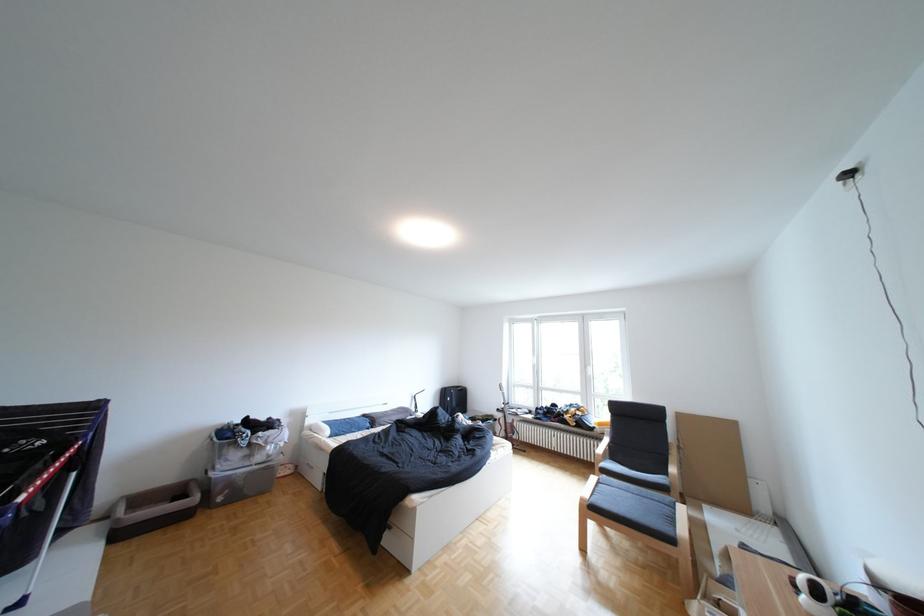
The height and width of the screenshot is (616, 924). Describe the element at coordinates (454, 399) in the screenshot. I see `a black suitcase` at that location.